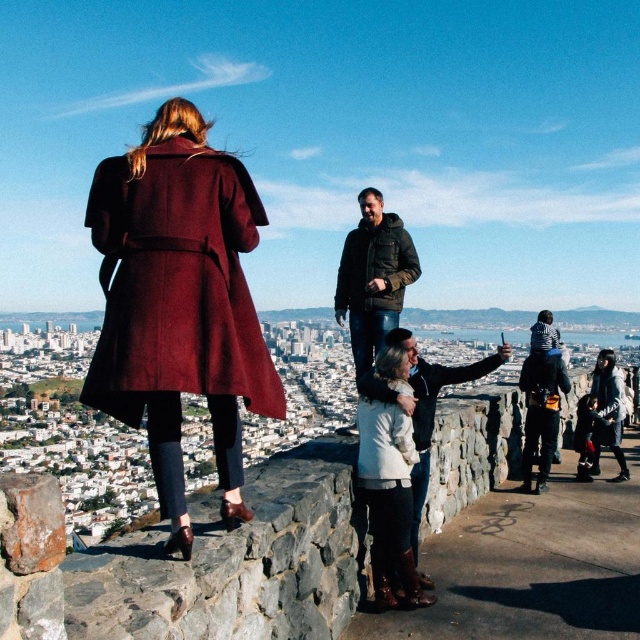
Question: Among these objects, which one is nearest to the camera?

Choices:
 (A) dark green jacket at center
 (B) burgundy wool coat at upper left
 (C) green textured jacket at center

Answer: (B)

Question: Estimate the real-world distances between objects in this image. Which object is farther from the matte black jacket at lower right?

Choices:
 (A) green textured jacket at center
 (B) dark green jacket at center

Answer: (A)

Question: Is burgundy wool coat at upper left closer to the viewer compared to white matte coat at lower center?

Choices:
 (A) yes
 (B) no

Answer: (A)

Question: Does green textured jacket at center have a smaller size compared to dark green jacket at center?

Choices:
 (A) yes
 (B) no

Answer: (A)

Question: Among these points, which one is farthest from the camera?

Choices:
 (A) (618, 451)
 (B) (378, 221)
 (C) (432, 412)
 (D) (364, 420)

Answer: (A)

Question: Is burgundy wool coat at upper left to the right of dark green jacket at center from the viewer's perspective?

Choices:
 (A) yes
 (B) no

Answer: (B)